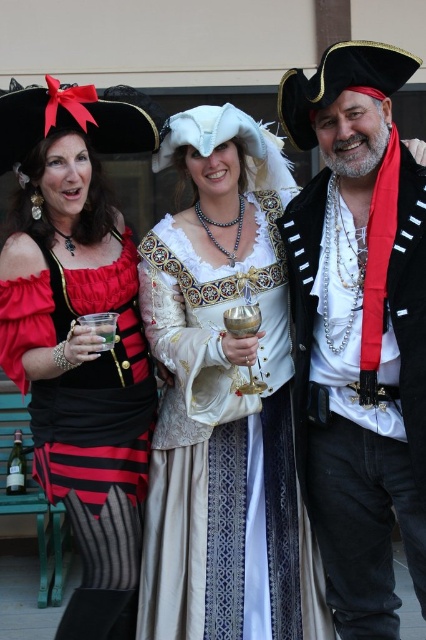
Based on the scene description, which object is bigger between the white satin dress at center and the shiny black pirate hat at right?

The white satin dress at center is larger than the shiny black pirate hat at right.

You are a photographer at the event and need to ensure both the white satin dress at center and the matte black pirate hat at upper left are visible in the frame. Which object should you focus on to capture both in the same shot?

The white satin dress at center is larger in size than the matte black pirate hat at upper left, so focusing on the dress will ensure both are visible in the frame.